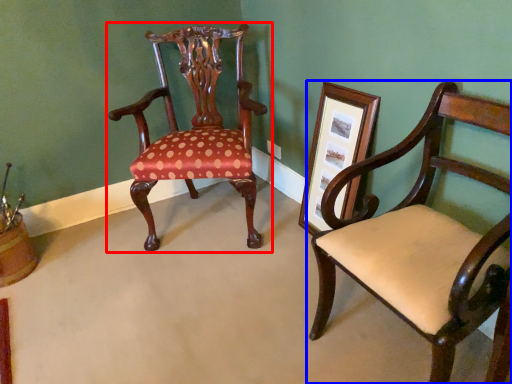
Question: Which of the following is the farthest to the observer, chair (highlighted by a red box) or chair (highlighted by a blue box)?

Choices:
 (A) chair
 (B) chair

Answer: (A)